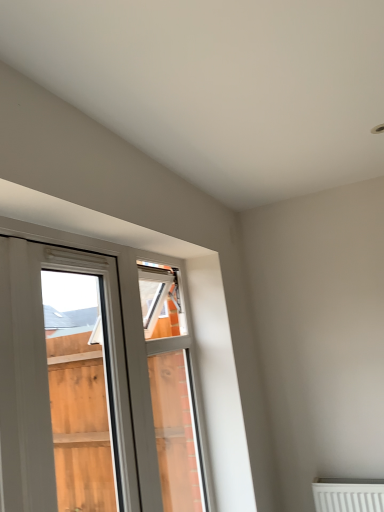
Question: Would you say white plastic window frame at center is to the left or to the right of white plastic window at left in the picture?

Choices:
 (A) right
 (B) left

Answer: (A)

Question: Relative to white plastic window at left, is white plastic window frame at center in front or behind?

Choices:
 (A) behind
 (B) front

Answer: (A)

Question: From the image's perspective, is white plastic window frame at center above or below white plastic window at left?

Choices:
 (A) below
 (B) above

Answer: (A)

Question: Considering the positions of point (13, 503) and point (188, 501), is point (13, 503) closer or farther from the camera than point (188, 501)?

Choices:
 (A) farther
 (B) closer

Answer: (B)

Question: Looking at their shapes, would you say white plastic window at left is wider or thinner than white plastic window frame at center?

Choices:
 (A) wide
 (B) thin

Answer: (B)

Question: Relative to white plastic window frame at center, is white plastic window at left in front or behind?

Choices:
 (A) behind
 (B) front

Answer: (B)

Question: Is white plastic window at left bigger or smaller than white plastic window frame at center?

Choices:
 (A) big
 (B) small

Answer: (B)